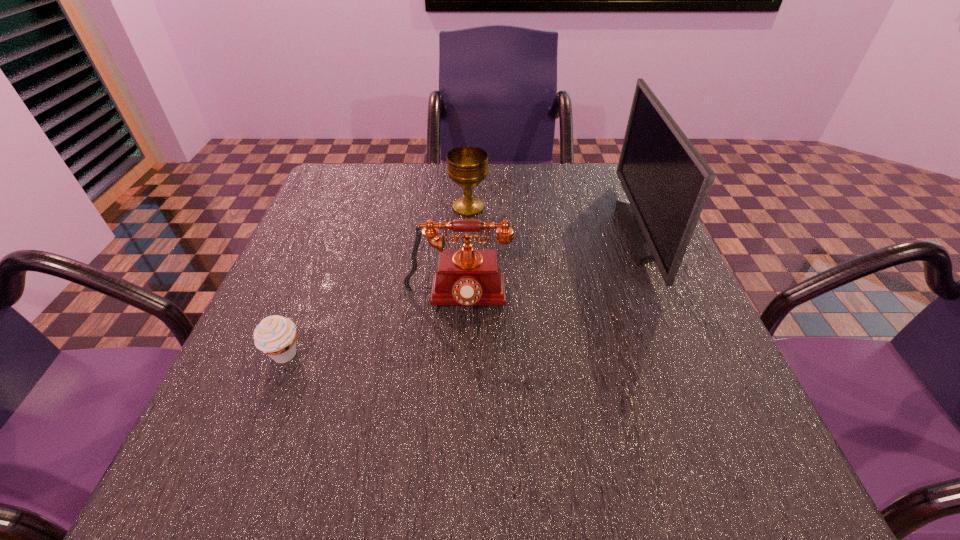
The width and height of the screenshot is (960, 540). In order to click on the rightmost object in this screenshot , I will do `click(666, 180)`.

This screenshot has width=960, height=540. I want to click on the tallest object, so click(x=666, y=180).

You are a GUI agent. You are given a task and a screenshot of the screen. Output one action in this format:
    pyautogui.click(x=<x>, y=<y>)
    Task: Click on the telephone
    This screenshot has width=960, height=540.
    Given the screenshot: What is the action you would take?
    pyautogui.click(x=467, y=276)

This screenshot has height=540, width=960. Find the location of `the second shortest object`. the second shortest object is located at coordinates (467, 166).

Locate an element on the screen. The image size is (960, 540). the nearest object is located at coordinates (275, 335).

Locate an element on the screen. Image resolution: width=960 pixels, height=540 pixels. muffin is located at coordinates (275, 335).

This screenshot has width=960, height=540. Find the location of `vacant region located on the screen side of the monitor`. vacant region located on the screen side of the monitor is located at coordinates (480, 232).

You are a GUI agent. You are given a task and a screenshot of the screen. Output one action in this format:
    pyautogui.click(x=<x>, y=<y>)
    Task: Click on the free point located 0.050m on the screen side of the monitor
    The height and width of the screenshot is (540, 960).
    Given the screenshot: What is the action you would take?
    pyautogui.click(x=605, y=232)

This screenshot has width=960, height=540. What are the coordinates of `free location located on the screen side of the monitor` in the screenshot? It's located at (463, 232).

This screenshot has height=540, width=960. Identify the location of free point located on the dial of the telephone. (451, 410).